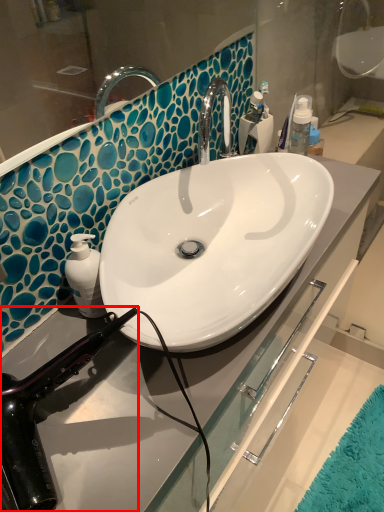
Question: Where is hair drier (annotated by the red box) located in relation to toiletry in the image?

Choices:
 (A) right
 (B) left

Answer: (B)